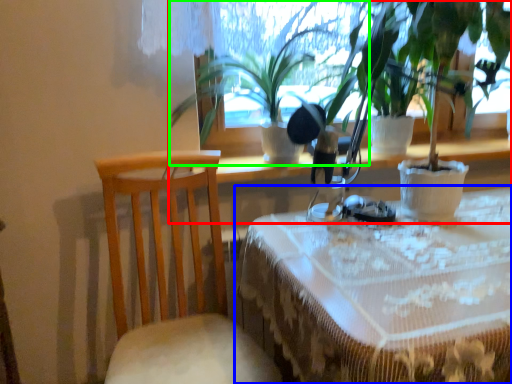
Question: Estimate the real-world distances between objects in this image. Which object is closer to houseplant (highlighted by a red box), table (highlighted by a blue box) or houseplant (highlighted by a green box)?

Choices:
 (A) table
 (B) houseplant

Answer: (B)